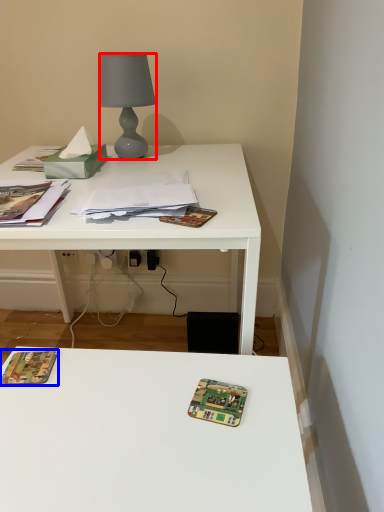
Question: Among these objects, which one is farthest to the camera, lamp (highlighted by a red box) or paperback book (highlighted by a blue box)?

Choices:
 (A) lamp
 (B) paperback book

Answer: (A)